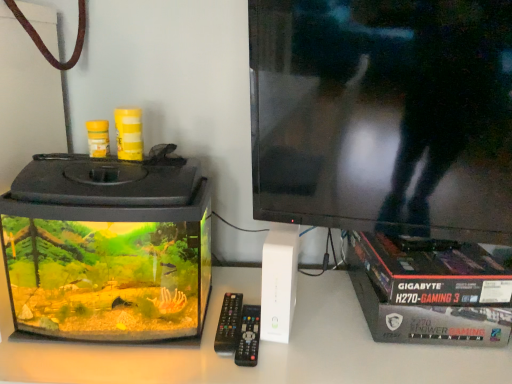
Question: Would you say transparent glass aquarium at left is part of black plastic remote at center's contents?

Choices:
 (A) no
 (B) yes

Answer: (A)

Question: From a real-world perspective, is black plastic remote at center over transparent glass aquarium at left?

Choices:
 (A) no
 (B) yes

Answer: (A)

Question: Does black plastic remote at center turn towards transparent glass aquarium at left?

Choices:
 (A) yes
 (B) no

Answer: (B)

Question: Does black plastic remote at center have a greater height compared to transparent glass aquarium at left?

Choices:
 (A) no
 (B) yes

Answer: (A)

Question: Can you confirm if black plastic remote at center is wider than transparent glass aquarium at left?

Choices:
 (A) yes
 (B) no

Answer: (B)

Question: Is black plastic remote at center at the left side of transparent glass aquarium at left?

Choices:
 (A) yes
 (B) no

Answer: (B)

Question: Are transparent glass aquarium at left and black plastic remote at center far apart?

Choices:
 (A) no
 (B) yes

Answer: (A)

Question: Considering the relative sizes of transparent glass aquarium at left and black plastic remote at center in the image provided, is transparent glass aquarium at left wider than black plastic remote at center?

Choices:
 (A) yes
 (B) no

Answer: (A)

Question: Is transparent glass aquarium at left at the left side of black plastic remote at center?

Choices:
 (A) yes
 (B) no

Answer: (A)

Question: Is the position of transparent glass aquarium at left less distant than that of black plastic remote at center?

Choices:
 (A) no
 (B) yes

Answer: (B)

Question: From the image's perspective, is transparent glass aquarium at left above black plastic remote at center?

Choices:
 (A) no
 (B) yes

Answer: (B)

Question: Considering the relative sizes of transparent glass aquarium at left and black plastic remote at center in the image provided, is transparent glass aquarium at left taller than black plastic remote at center?

Choices:
 (A) no
 (B) yes

Answer: (B)

Question: In terms of height, does black plastic remote at center look taller or shorter compared to transparent glass aquarium at left?

Choices:
 (A) short
 (B) tall

Answer: (A)